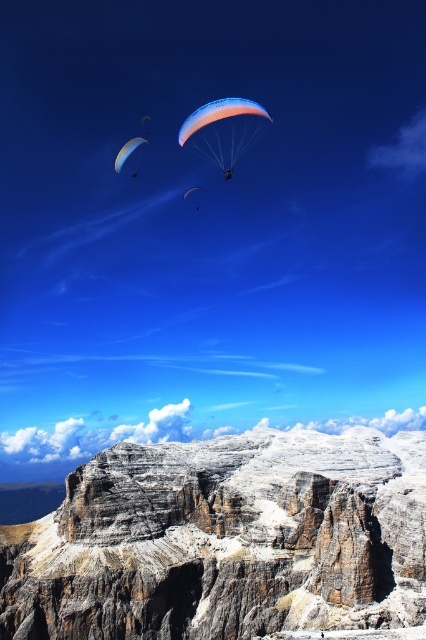
Question: Which point appears farthest from the camera in this image?

Choices:
 (A) (233, 152)
 (B) (298, 584)
 (C) (146, 140)

Answer: (A)

Question: Based on their relative distances, which object is nearer to the rocky cliff at lower center?

Choices:
 (A) matte blue parachute at upper left
 (B) translucent orange parachute at center
 (C) matte orange parachute at upper center

Answer: (B)

Question: Is matte blue parachute at upper left below matte orange parachute at upper center?

Choices:
 (A) no
 (B) yes

Answer: (A)

Question: Observing the image, what is the correct spatial positioning of matte blue parachute at upper left in reference to matte orange parachute at upper center?

Choices:
 (A) above
 (B) below

Answer: (A)

Question: Which object is farther from the camera taking this photo?

Choices:
 (A) translucent orange parachute at center
 (B) matte orange parachute at upper center
 (C) rocky cliff at lower center

Answer: (B)

Question: Does rocky cliff at lower center come behind matte orange parachute at upper center?

Choices:
 (A) yes
 (B) no

Answer: (B)